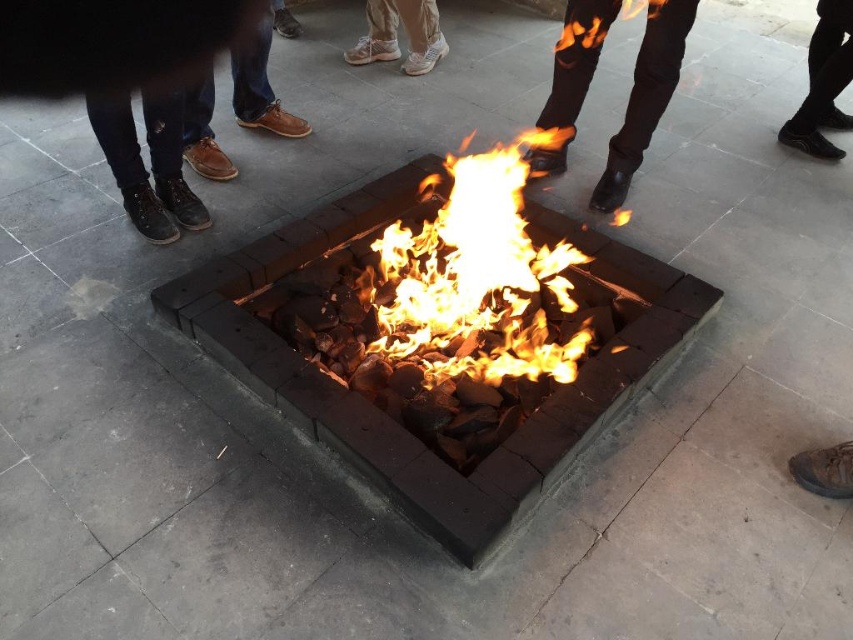
You are standing at point (364,42) and want to walk to point (262,112). Is the path directly ahead of you?

Yes, the path is directly ahead because point (262,112) is in front of point (364,42).

You are standing near the fire pit and want to move to the area where the brown leather shoe at lower right is located. Which direction should you move relative to the leather boots at center?

You should move to the right relative to the leather boots at center because the brown leather shoe at lower right is positioned to the right of the leather boots at center.